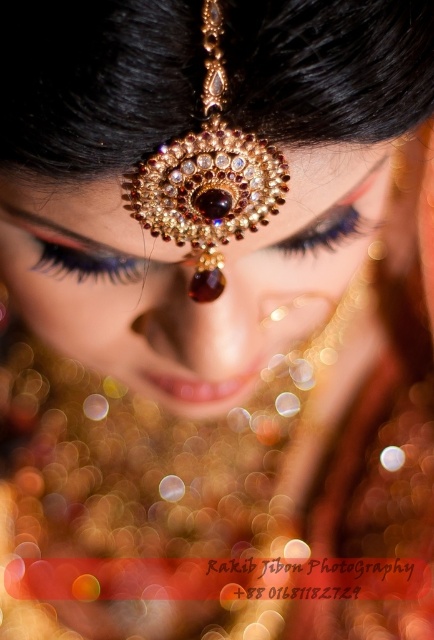
Question: Which point is closer to the camera taking this photo?

Choices:
 (A) (55, 256)
 (B) (351, 214)

Answer: (A)

Question: Does gold textured forehead ornament at center have a smaller size compared to black matte eyelashes at upper left?

Choices:
 (A) yes
 (B) no

Answer: (B)

Question: Among these points, which one is nearest to the camera?

Choices:
 (A) (65, 211)
 (B) (286, 252)
 (C) (55, 257)
 (D) (81, 346)

Answer: (A)

Question: Observing the image, what is the correct spatial positioning of gold textured jewelry at center in reference to gold textured forehead ornament at center?

Choices:
 (A) above
 (B) below

Answer: (B)

Question: From the image, what is the correct spatial relationship of gold textured jewelry at center in relation to black matte eyelashes at upper left?

Choices:
 (A) below
 (B) above

Answer: (A)

Question: Which point is closer to the camera?

Choices:
 (A) (35, 225)
 (B) (328, 211)
 (C) (78, 257)
 (D) (331, 241)

Answer: (A)